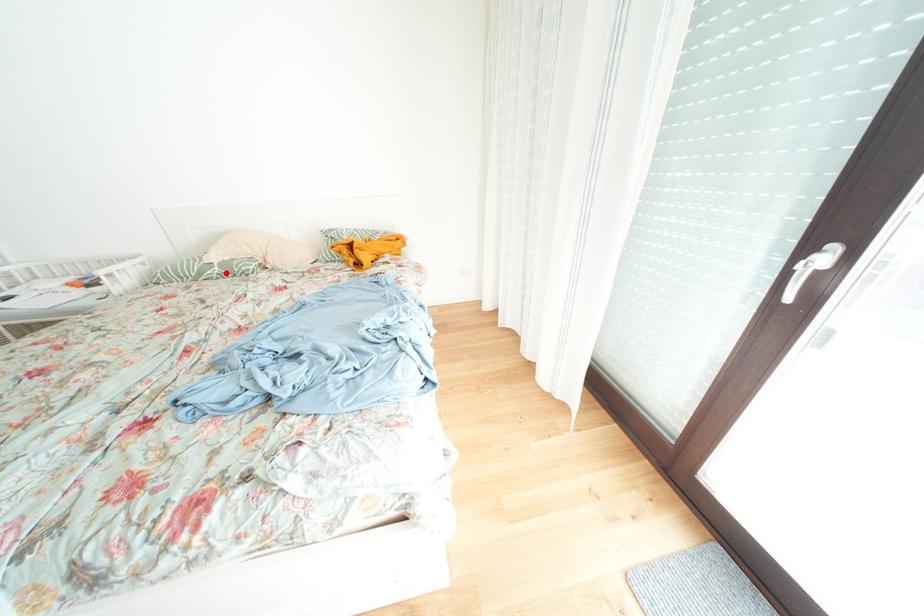
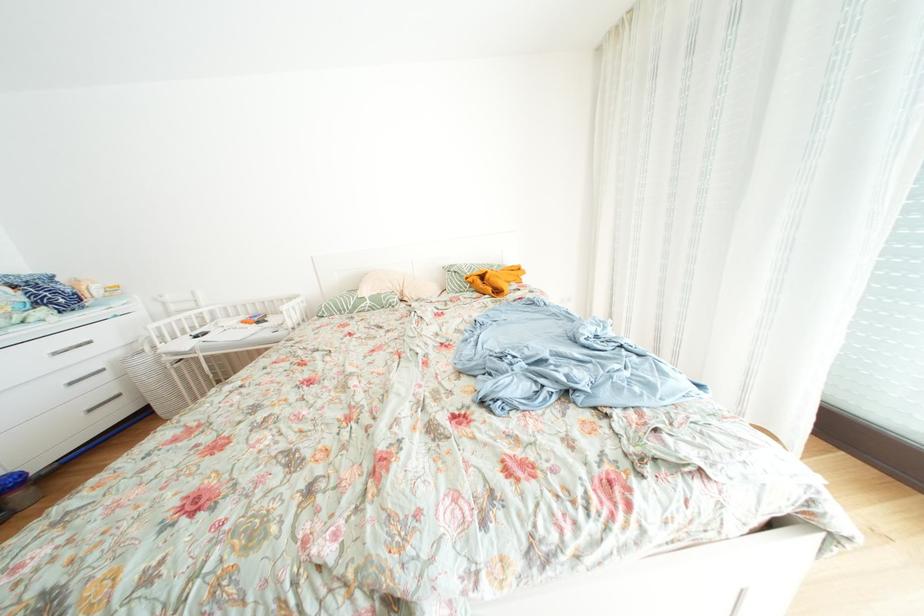
Question: I am providing you with two images of the same scene from different viewpoints. A red point is marked on the first image. At the location where the point appears in image 1, is it still visible in image 2?

Choices:
 (A) Yes
 (B) No

Answer: (A)